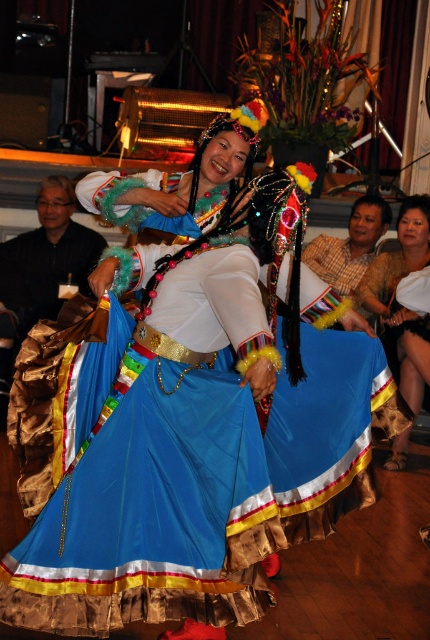
You are a photographer planning to capture a photo of the dance performance. You notice the matte brown jacket at left and the silky brown dress at lower right in the frame. Which object should you focus on if you want to highlight something that occupies more vertical space in the image?

The silky brown dress at lower right should be focused on because it has a greater height compared to the matte brown jacket at left, making it occupy more vertical space in the image.

You are a photographer at the dance performance. You want to take a photo that includes both the matte brown jacket at left and the plaid shirt at right. Which object should you focus on first to ensure both are in the frame?

The matte brown jacket at left is in front of the plaid shirt at right, so you should focus on the matte brown jacket at left first to ensure both are in the frame.